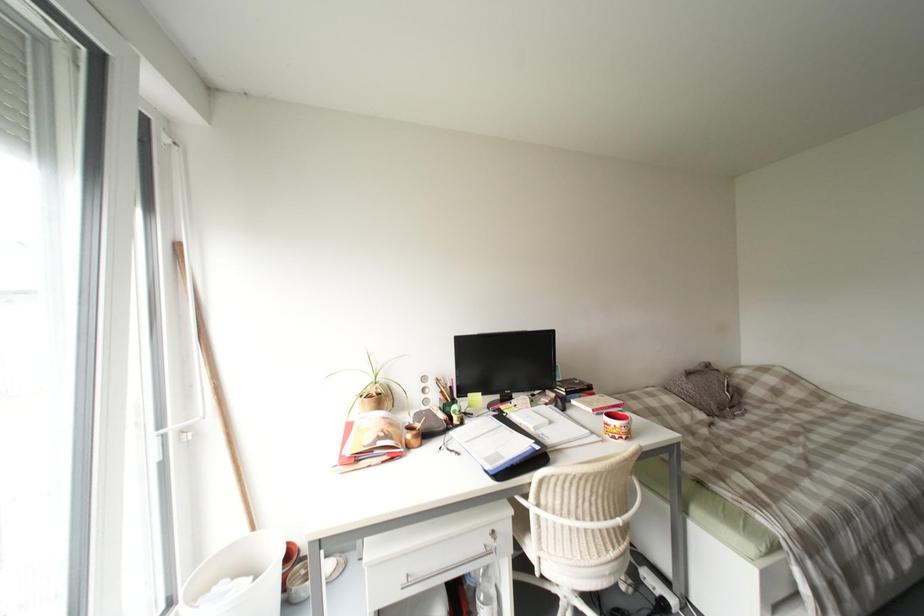
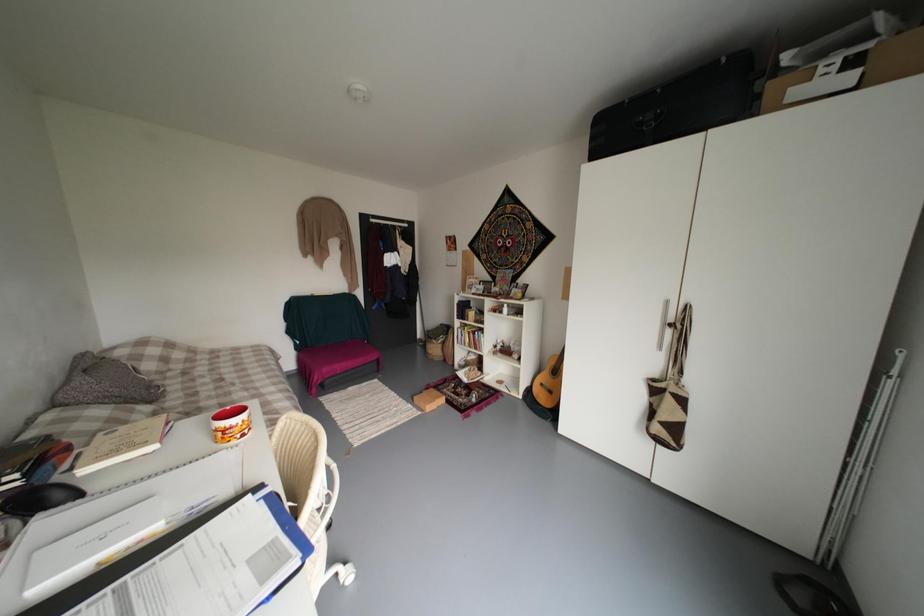
Question: The first image is from the beginning of the video and the second image is from the end. How did the camera likely rotate when shooting the video?

Choices:
 (A) Left
 (B) Right
 (C) Up
 (D) Down

Answer: (B)